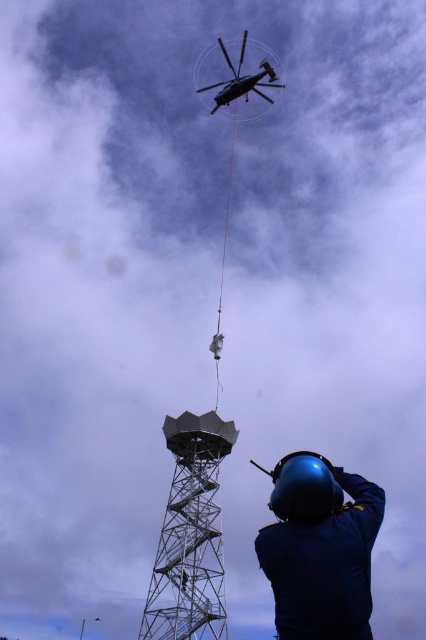
You are a construction worker standing near the blue hard hat at lower right and looking up at the metallic gray helicopter at upper center. Which object is closer to your eyes?

The blue hard hat at lower right is closer to your eyes because it is positioned at the lower right, while the metallic gray helicopter at upper center is higher up in the scene.

You are a pilot flying the metallic gray helicopter at upper center and need to lower a heavy load attached to the red rope. The load must be placed precisely on the metallic gray tower at center. Based on the scene description, can you confirm if the helicopter is directly above the tower?

Yes, the metallic gray helicopter at upper center is positioned above the metallic gray tower at center, so it is directly above it, allowing the pilot to lower the load accurately onto the tower.